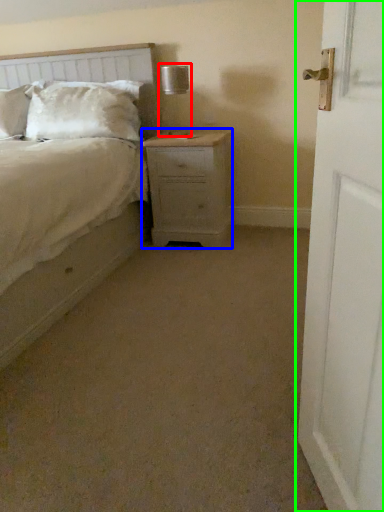
Question: Which is nearer to the table lamp (highlighted by a red box)? nightstand (highlighted by a blue box) or door (highlighted by a green box).

Choices:
 (A) nightstand
 (B) door

Answer: (A)